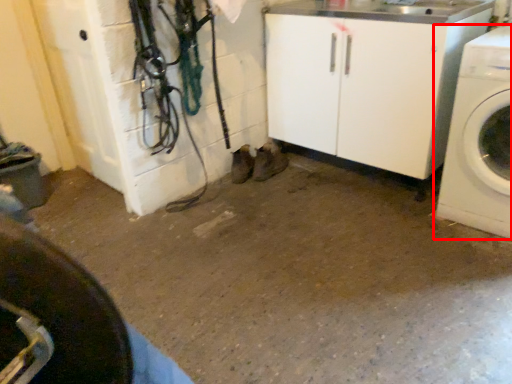
Question: From the image's perspective, where is washing machine (annotated by the red box) located in relation to tire in the image?

Choices:
 (A) above
 (B) below

Answer: (A)